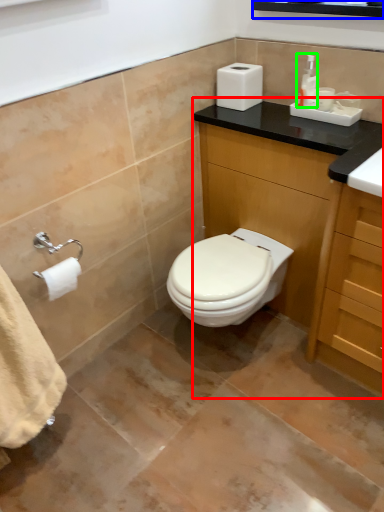
Question: Which object is positioned closest to bathroom cabinet (highlighted by a red box)? Select from medicine cabinet (highlighted by a blue box) and toiletry (highlighted by a green box).

Choices:
 (A) medicine cabinet
 (B) toiletry

Answer: (B)